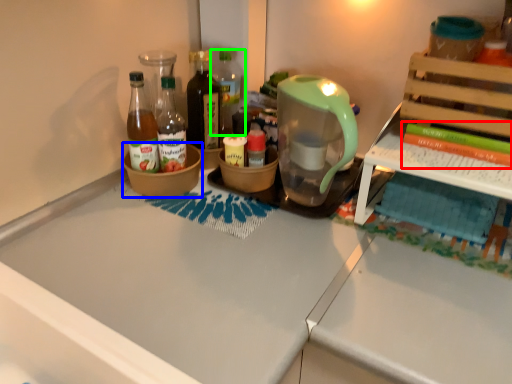
Question: Which object is the farthest from book (highlighted by a red box)? Choose among these: bowl (highlighted by a blue box) or bottle (highlighted by a green box).

Choices:
 (A) bowl
 (B) bottle

Answer: (A)